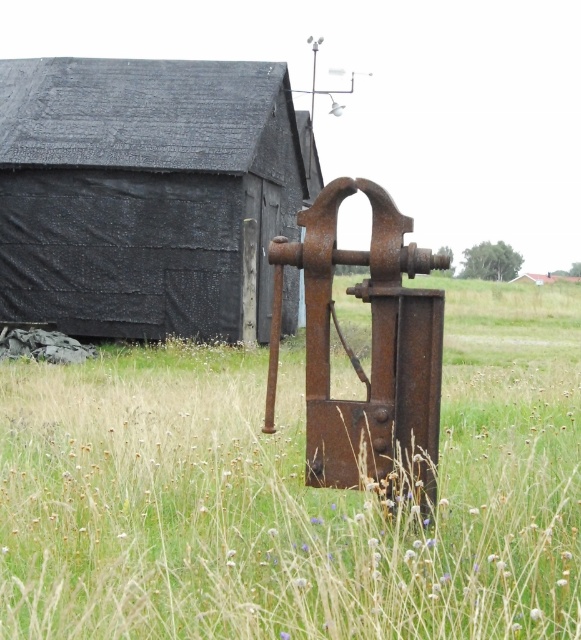
You are standing in a field and see the dry grass at center and the rusty metal barn at center. Which object is taller?

The dry grass at center is much taller than the rusty metal barn at center.

You are standing in a field and see the dry grass at center and the rusty metal barn at center. Which object is nearer to you?

The dry grass at center is closer to the viewer than the rusty metal barn at center.

You are standing at the point with coordinates point (229, 156) and want to walk towards the point with coordinates point (130, 442). Which direction should you face to walk directly towards your destination?

You should face towards the direction of point (130, 442) because it is in front of point (229, 156).